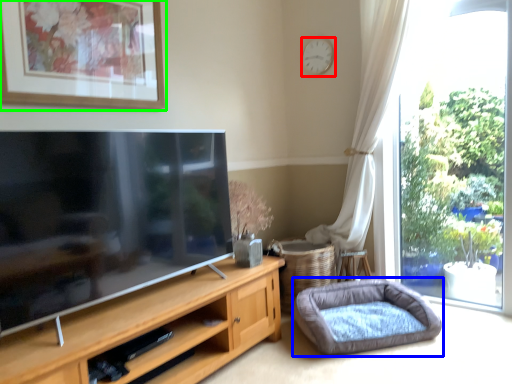
Question: Considering the real-world distances, which object is farthest from clock (highlighted by a red box)? dog bed (highlighted by a blue box) or picture frame (highlighted by a green box)?

Choices:
 (A) dog bed
 (B) picture frame

Answer: (A)